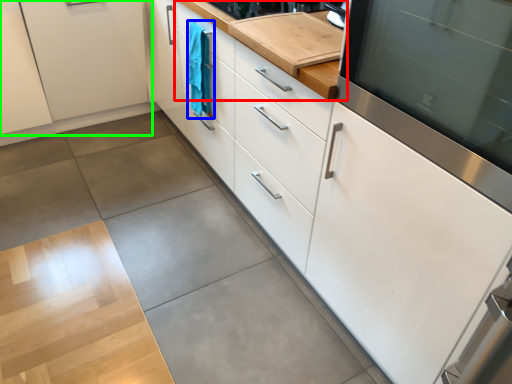
Question: Which object is positioned farthest from countertop (highlighted by a red box)? Select from laundry (highlighted by a blue box) and cabinetry (highlighted by a green box).

Choices:
 (A) laundry
 (B) cabinetry

Answer: (B)